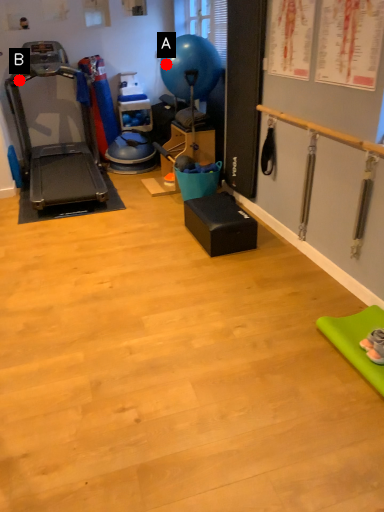
Question: Two points are circled on the image, labeled by A and B beside each circle. Which point is closer to the camera taking this photo?

Choices:
 (A) A is closer
 (B) B is closer

Answer: (A)